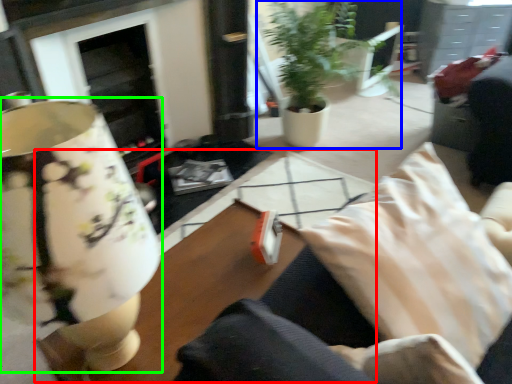
Question: Estimate the real-world distances between objects in this image. Which object is closer to table (highlighted by a red box), houseplant (highlighted by a blue box) or table lamp (highlighted by a green box)?

Choices:
 (A) houseplant
 (B) table lamp

Answer: (B)